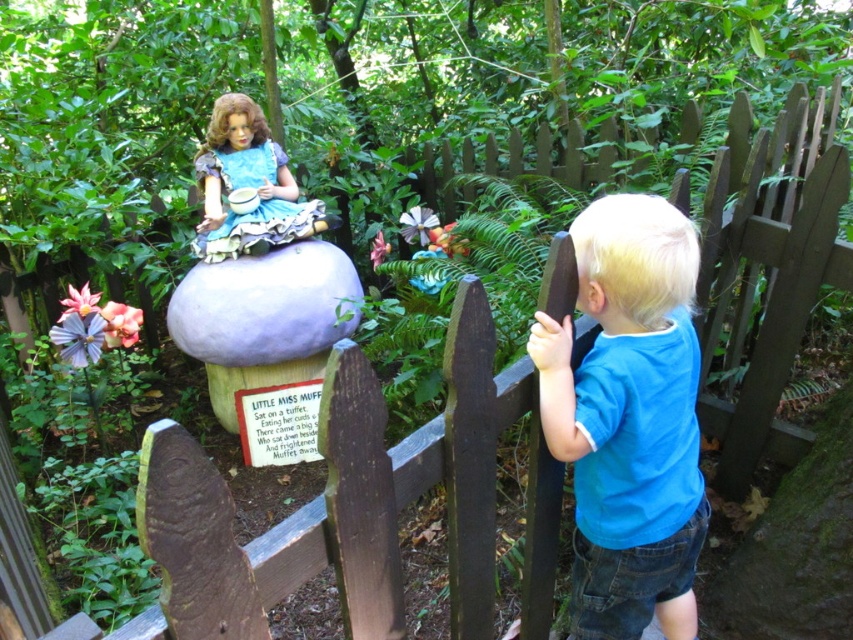
Between blue cotton shirt at right and matte blue fabric doll at upper center, which one has less height?

matte blue fabric doll at upper center

In the scene shown: Does blue cotton shirt at right appear on the right side of matte blue fabric doll at upper center?

Yes, blue cotton shirt at right is to the right of matte blue fabric doll at upper center.

This screenshot has width=853, height=640. What do you see at coordinates (630, 419) in the screenshot?
I see `blue cotton shirt at right` at bounding box center [630, 419].

I want to click on blue cotton shirt at right, so click(630, 419).